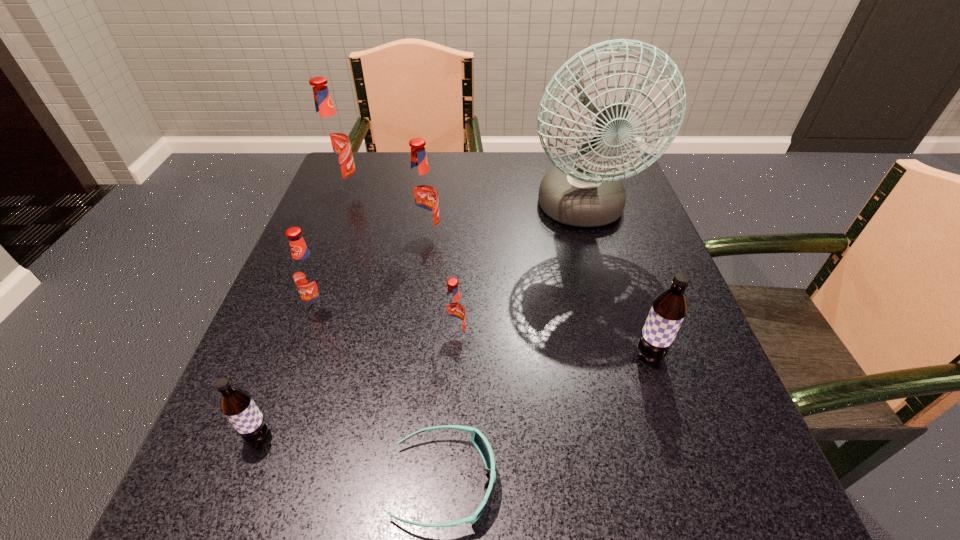
In the image, there is a desktop. What are the coordinates of `vacant space at the far edge` in the screenshot? It's located at (476, 199).

Locate an element on the screen. This screenshot has height=540, width=960. vacant space at the near edge is located at coordinates (530, 498).

Where is `free space at the left edge`? The height and width of the screenshot is (540, 960). free space at the left edge is located at coordinates (355, 263).

Locate an element on the screen. This screenshot has width=960, height=540. blank area at the right edge is located at coordinates [x=660, y=390].

What are the coordinates of `free space at the far left corner of the desktop` in the screenshot? It's located at (373, 158).

The height and width of the screenshot is (540, 960). Identify the location of free space at the near left corner of the desktop. point(300,487).

Locate an element on the screen. vacant area that lies between the fourth root beer from left to right and the second tallest object is located at coordinates (386, 213).

At what (x,y) coordinates should I click in order to perform the action: click on empty location between the farther brown root beer and the sunglasses. Please return your answer as a coordinate pair (x, y). Looking at the image, I should click on (547, 418).

You are a GUI agent. You are given a task and a screenshot of the screen. Output one action in this format:
    pyautogui.click(x=<x>, y=<y>)
    Task: Click on the free space that is in between the third red root beer from left to right and the biggest red root beer
    This screenshot has height=540, width=960.
    Given the screenshot: What is the action you would take?
    pyautogui.click(x=386, y=213)

This screenshot has height=540, width=960. Identify the location of free space that is in between the nearest red root beer and the third smallest red root beer. (442, 287).